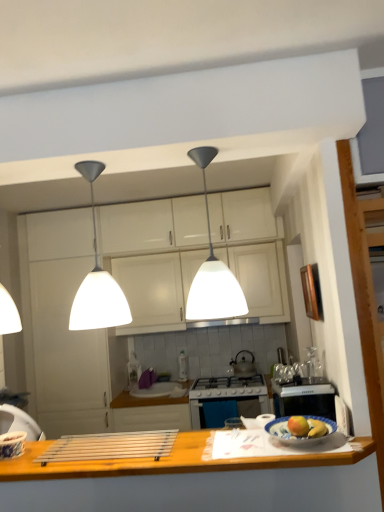
Question: Can you confirm if white matte cabinet at center, positioned as the second cabinetry in top-to-bottom order, is positioned to the right of metallic silver kettle at center?

Choices:
 (A) yes
 (B) no

Answer: (A)

Question: Does white matte cabinet at center, which is the first cabinetry in bottom-to-top order, have a smaller size compared to metallic silver kettle at center?

Choices:
 (A) yes
 (B) no

Answer: (B)

Question: Is white matte cabinet at center, positioned as the second cabinetry in top-to-bottom order, looking in the opposite direction of metallic silver kettle at center?

Choices:
 (A) no
 (B) yes

Answer: (A)

Question: Does white matte cabinet at center, positioned as the second cabinetry in top-to-bottom order, come in front of metallic silver kettle at center?

Choices:
 (A) no
 (B) yes

Answer: (B)

Question: Can you see white matte cabinet at center, positioned as the second cabinetry in top-to-bottom order, touching metallic silver kettle at center?

Choices:
 (A) no
 (B) yes

Answer: (A)

Question: Does point (158, 286) appear closer or farther from the camera than point (296, 421)?

Choices:
 (A) farther
 (B) closer

Answer: (A)

Question: Is white matte cabinet at center, positioned as the second cabinetry in top-to-bottom order, in front of or behind yellow matte apple at center, the 1th apple in the left-to-right sequence, in the image?

Choices:
 (A) behind
 (B) front

Answer: (A)

Question: Considering the positions of white matte cabinet at center, which is the first cabinetry in bottom-to-top order, and yellow matte apple at center, the 2th apple when ordered from right to left, in the image, is white matte cabinet at center, which is the first cabinetry in bottom-to-top order, wider or thinner than yellow matte apple at center, the 2th apple when ordered from right to left,?

Choices:
 (A) thin
 (B) wide

Answer: (B)

Question: From a real-world perspective, relative to yellow matte apple at center, the 1th apple in the left-to-right sequence, is white matte cabinet at center, positioned as the second cabinetry in top-to-bottom order, vertically above or below?

Choices:
 (A) below
 (B) above

Answer: (B)

Question: Would you say matte yellow apple at center, which is the 2th apple in left-to-right order, is to the left or to the right of white matte cabinet at center, positioned as the second cabinetry in top-to-bottom order, in the picture?

Choices:
 (A) right
 (B) left

Answer: (A)

Question: In terms of width, does matte yellow apple at center, positioned as the 1th apple in right-to-left order, look wider or thinner when compared to white matte cabinet at center, positioned as the second cabinetry in top-to-bottom order?

Choices:
 (A) wide
 (B) thin

Answer: (B)

Question: Is matte yellow apple at center, positioned as the 1th apple in right-to-left order, inside the boundaries of white matte cabinet at center, which is the first cabinetry in bottom-to-top order, or outside?

Choices:
 (A) outside
 (B) inside

Answer: (A)

Question: Considering the positions of matte yellow apple at center, positioned as the 1th apple in right-to-left order, and white matte cabinet at center, positioned as the second cabinetry in top-to-bottom order, in the image, is matte yellow apple at center, positioned as the 1th apple in right-to-left order, bigger or smaller than white matte cabinet at center, positioned as the second cabinetry in top-to-bottom order,?

Choices:
 (A) big
 (B) small

Answer: (B)

Question: Do you think wooden at lower center is within metallic silver faucet at center, or outside of it?

Choices:
 (A) inside
 (B) outside

Answer: (B)

Question: Looking at their shapes, would you say wooden at lower center is wider or thinner than metallic silver faucet at center?

Choices:
 (A) wide
 (B) thin

Answer: (A)